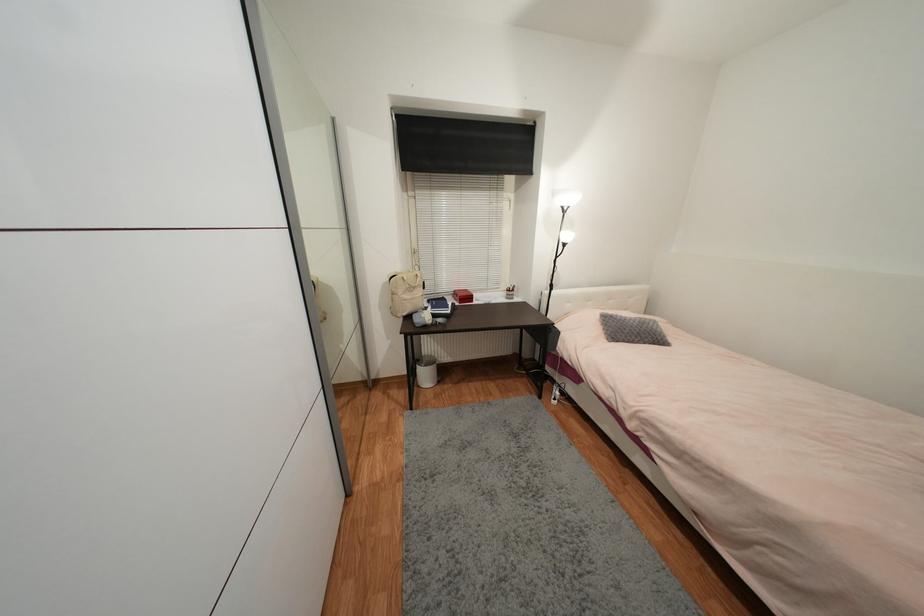
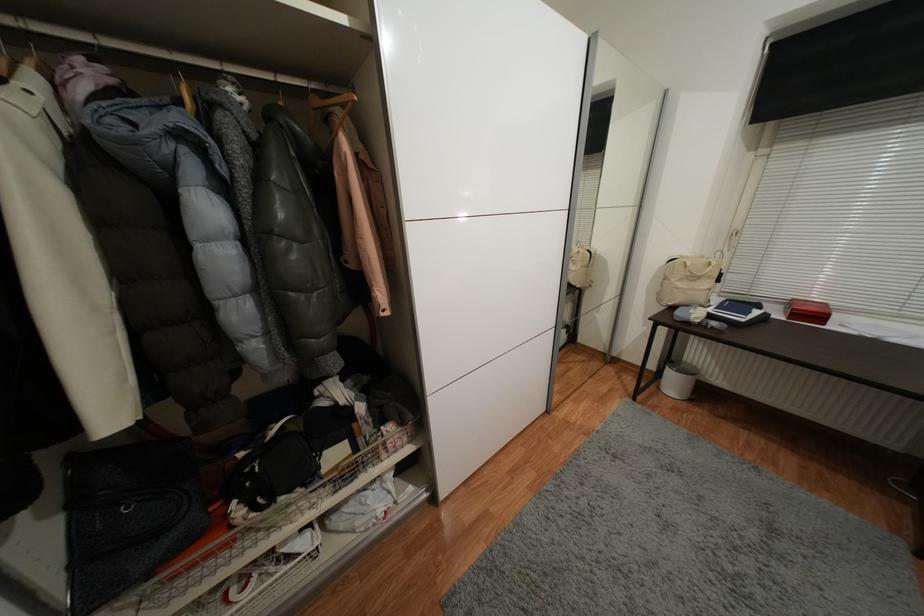
Locate, in the second image, the point that corresponds to point (454, 313) in the first image.

(747, 321)